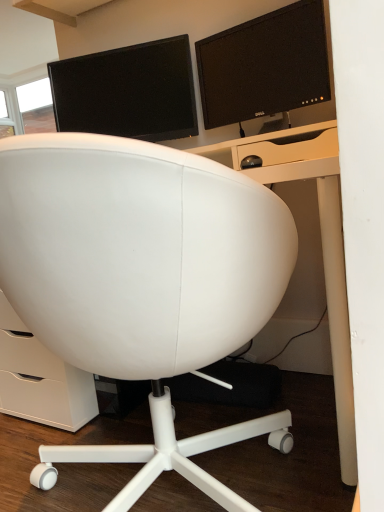
Question: Choose the correct answer: Is white leather chair at center inside matte black monitor at upper center, which ranks as the second computer monitor in right-to-left order, or outside it?

Choices:
 (A) outside
 (B) inside

Answer: (A)

Question: Is white leather chair at center bigger or smaller than matte black monitor at upper center, which is counted as the first computer monitor, starting from the left?

Choices:
 (A) big
 (B) small

Answer: (A)

Question: Based on their relative distances, which object is nearer to the matte black monitor at upper center, which is counted as the first computer monitor, starting from the left?

Choices:
 (A) white leather chair at center
 (B) matte black monitor at upper center, acting as the second computer monitor starting from the left

Answer: (B)

Question: Which of these objects is positioned closest to the matte black monitor at upper center, which is counted as the first computer monitor, starting from the left?

Choices:
 (A) matte black monitor at upper center, positioned as the first computer monitor in right-to-left order
 (B) white leather chair at center

Answer: (A)